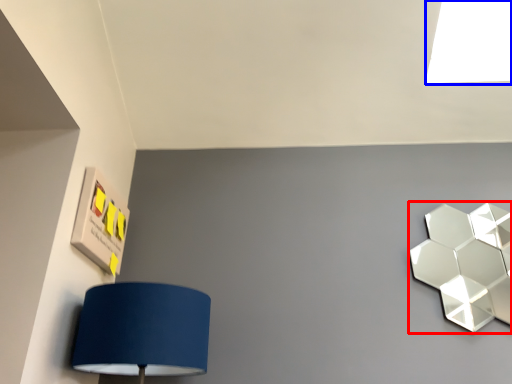
Question: Which point is closer to the camera, lamp (highlighted by a red box) or light (highlighted by a blue box)?

Choices:
 (A) lamp
 (B) light

Answer: (A)